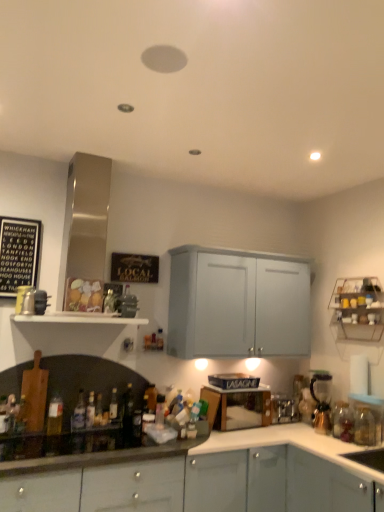
The width and height of the screenshot is (384, 512). Find the location of `vacant region under gold metallic coffee machine at right (from a real-world perspective)`. vacant region under gold metallic coffee machine at right (from a real-world perspective) is located at coordinates (311, 430).